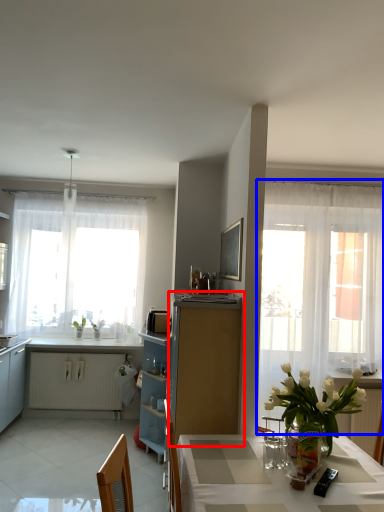
Question: Which object is closer to the camera taking this photo, cabinetry (highlighted by a red box) or curtain (highlighted by a blue box)?

Choices:
 (A) cabinetry
 (B) curtain

Answer: (A)